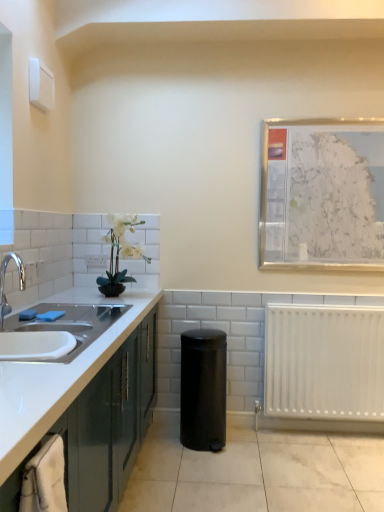
Locate an element on the screen. vacant point above metallic silver map at upper right (from a real-world perspective) is located at coordinates (348, 115).